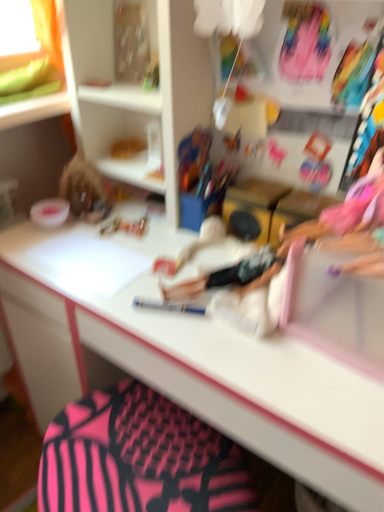
Question: From a real-world perspective, relative to pink fabric swivel chair at lower center, is white glossy desk at center vertically above or below?

Choices:
 (A) below
 (B) above

Answer: (B)

Question: Looking at the image, does white glossy desk at center seem bigger or smaller compared to pink fabric swivel chair at lower center?

Choices:
 (A) big
 (B) small

Answer: (A)

Question: Is white glossy desk at center wider or thinner than pink fabric swivel chair at lower center?

Choices:
 (A) wide
 (B) thin

Answer: (A)

Question: Considering the positions of pink fabric swivel chair at lower center and white glossy desk at center in the image, is pink fabric swivel chair at lower center taller or shorter than white glossy desk at center?

Choices:
 (A) tall
 (B) short

Answer: (B)

Question: Relative to white glossy desk at center, is pink fabric swivel chair at lower center in front or behind?

Choices:
 (A) front
 (B) behind

Answer: (B)

Question: Looking at their shapes, would you say pink fabric swivel chair at lower center is wider or thinner than white glossy desk at center?

Choices:
 (A) wide
 (B) thin

Answer: (B)

Question: Considering the positions of pink fabric swivel chair at lower center and white glossy desk at center in the image, is pink fabric swivel chair at lower center bigger or smaller than white glossy desk at center?

Choices:
 (A) small
 (B) big

Answer: (A)